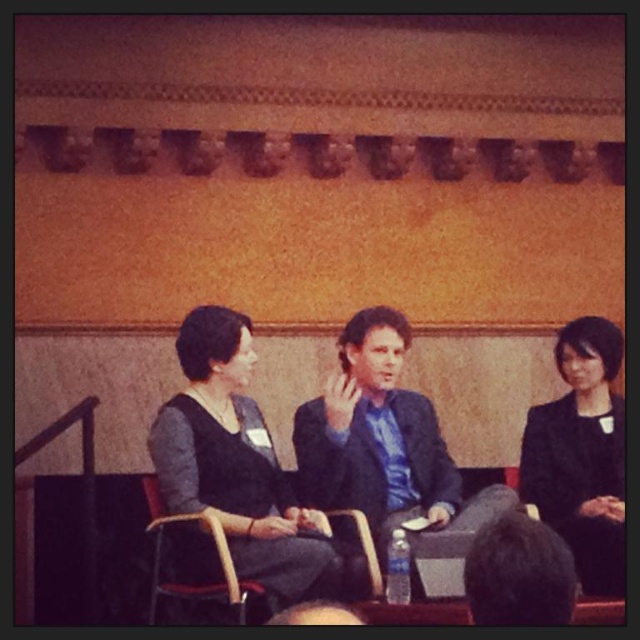
Question: Which object is positioned closest to the blue satin suit at center?

Choices:
 (A) dark gray sweater at center
 (B) wooden at left

Answer: (A)

Question: Is black matte blazer at right thinner than wooden at left?

Choices:
 (A) no
 (B) yes

Answer: (B)

Question: Is dark gray sweater at center positioned in front of black matte blazer at right?

Choices:
 (A) yes
 (B) no

Answer: (A)

Question: Based on their relative distances, which object is farther from the black matte blazer at right?

Choices:
 (A) dark gray sweater at center
 (B) blue satin suit at center

Answer: (A)

Question: Based on their relative distances, which object is nearer to the wooden at left?

Choices:
 (A) black matte blazer at right
 (B) blue satin suit at center
 (C) dark gray sweater at center

Answer: (C)

Question: Does black matte blazer at right appear on the right side of wooden at left?

Choices:
 (A) yes
 (B) no

Answer: (A)